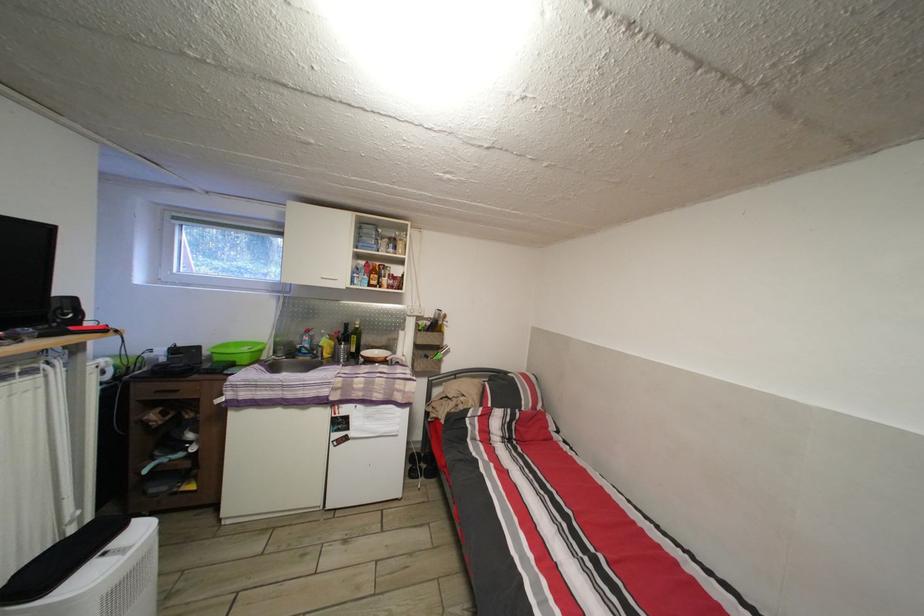
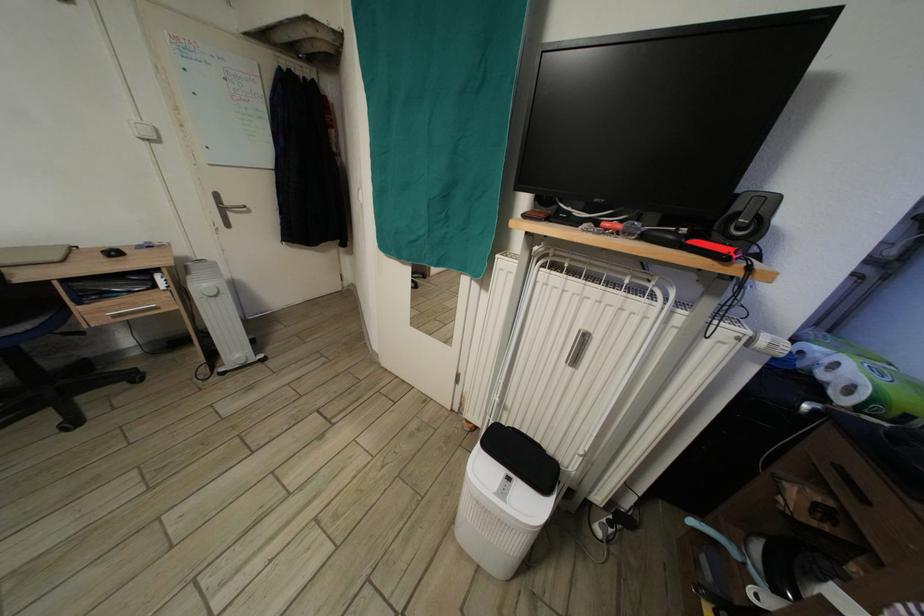
The point at (63, 312) is marked in the first image. Where is the corresponding point in the second image?

(744, 214)